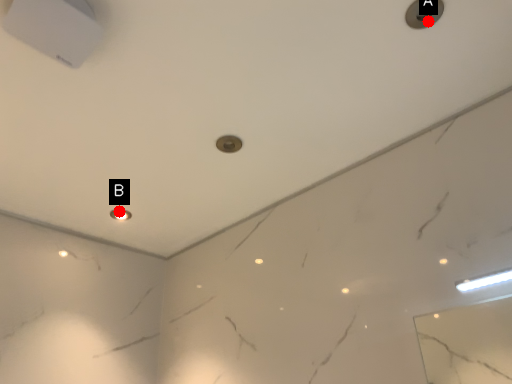
Question: Two points are circled on the image, labeled by A and B beside each circle. Which point is further to the camera?

Choices:
 (A) A is further
 (B) B is further

Answer: (B)